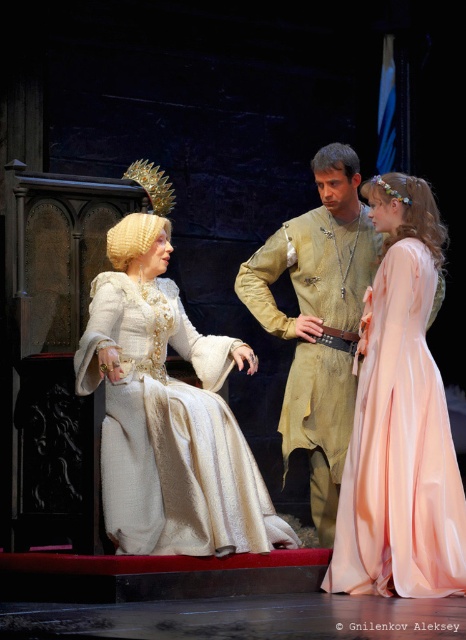
In the theatrical scene, there are two central characters wearing a white satin dress at center and a golden silk tunic at center. From the audience perspective, which one is positioned to the left?

The white satin dress at center is positioned to the left of the golden silk tunic at center.

You are a stagehand preparing to move the white satin dress at center and the pale pink satin dress at right for costume changes. Based on their positions, which dress is positioned higher on the stage?

The white satin dress at center is above the pale pink satin dress at right, so it is positioned higher on the stage.

You are an audience member sitting in the front row of the theater. You notice the white satin dress at center on stage. Can you reach out and touch it from where you are sitting?

The white satin dress at center is 23.71 meters away from the viewer, so you cannot reach out and touch it from where you are sitting.